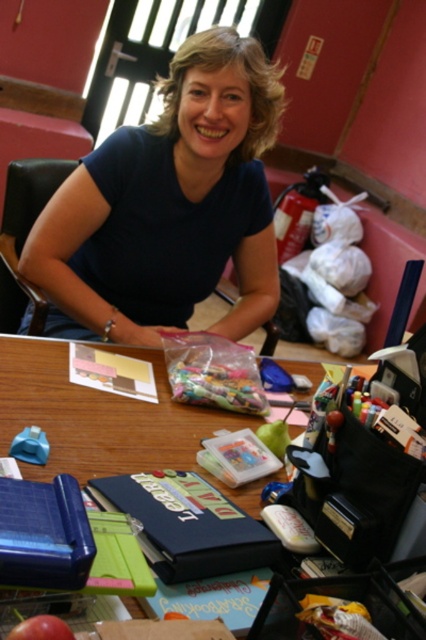
In the scene shown: You are a guest in the room and see the blue matte shirt at center and the wooden table at center. Which object is closer to the camera?

The blue matte shirt at center is closer to the camera because it is located above the wooden table at center, which is further away.

Consider the image. You are a photographer setting up a shot of the blue matte shirt at center and the wooden table at center. If you want to focus on the object closer to you, which one should you choose?

The blue matte shirt at center is closer to you than the wooden table at center, so you should focus on the blue matte shirt at center.